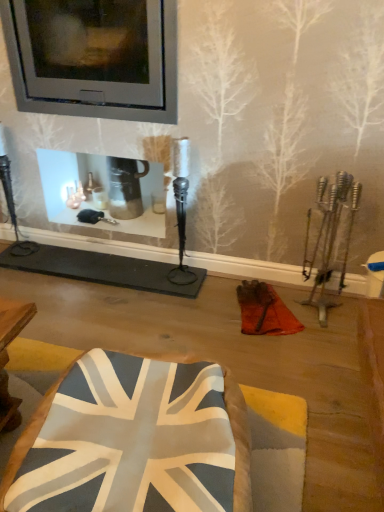
Question: Is metallic glass fireplace at upper center closer to the viewer compared to fabric union jack cushion at center?

Choices:
 (A) no
 (B) yes

Answer: (A)

Question: Does metallic glass fireplace at upper center have a lesser width compared to fabric union jack cushion at center?

Choices:
 (A) no
 (B) yes

Answer: (B)

Question: Considering the relative sizes of metallic glass fireplace at upper center and fabric union jack cushion at center in the image provided, is metallic glass fireplace at upper center taller than fabric union jack cushion at center?

Choices:
 (A) yes
 (B) no

Answer: (A)

Question: From a real-world perspective, is metallic glass fireplace at upper center located beneath fabric union jack cushion at center?

Choices:
 (A) yes
 (B) no

Answer: (B)

Question: Considering the relative positions of metallic glass fireplace at upper center and fabric union jack cushion at center in the image provided, is metallic glass fireplace at upper center behind fabric union jack cushion at center?

Choices:
 (A) yes
 (B) no

Answer: (A)

Question: Is metallic glass fireplace at upper center outside fabric union jack cushion at center?

Choices:
 (A) yes
 (B) no

Answer: (A)

Question: Is fabric union jack cushion at center not inside metallic glass fireplace at upper center?

Choices:
 (A) no
 (B) yes

Answer: (B)

Question: Can you confirm if fabric union jack cushion at center is smaller than metallic glass fireplace at upper center?

Choices:
 (A) no
 (B) yes

Answer: (B)

Question: Does fabric union jack cushion at center have a larger size compared to metallic glass fireplace at upper center?

Choices:
 (A) no
 (B) yes

Answer: (A)

Question: Is fabric union jack cushion at center shorter than metallic glass fireplace at upper center?

Choices:
 (A) yes
 (B) no

Answer: (A)

Question: Is the surface of fabric union jack cushion at center in direct contact with metallic glass fireplace at upper center?

Choices:
 (A) no
 (B) yes

Answer: (A)

Question: Is fabric union jack cushion at center to the right of metallic glass fireplace at upper center from the viewer's perspective?

Choices:
 (A) no
 (B) yes

Answer: (B)

Question: Is metallic glass fireplace at upper center in front of or behind fabric union jack cushion at center in the image?

Choices:
 (A) behind
 (B) front

Answer: (A)